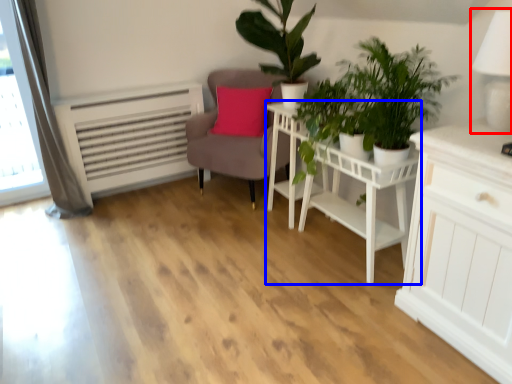
Question: Which object appears closest to the camera in this image, table lamp (highlighted by a red box) or table (highlighted by a blue box)?

Choices:
 (A) table lamp
 (B) table

Answer: (A)